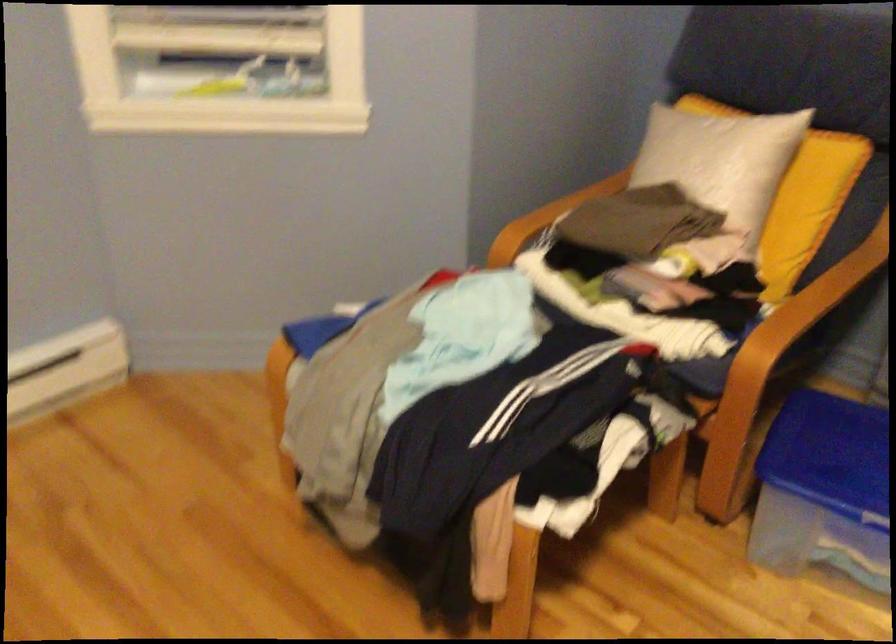
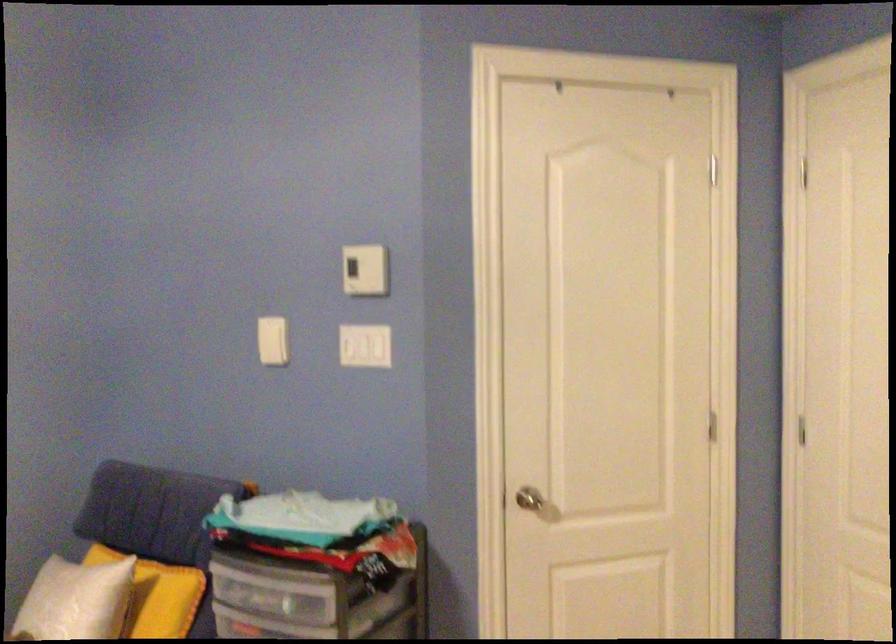
The point at (737,147) is marked in the first image. Where is the corresponding point in the second image?

(74, 601)